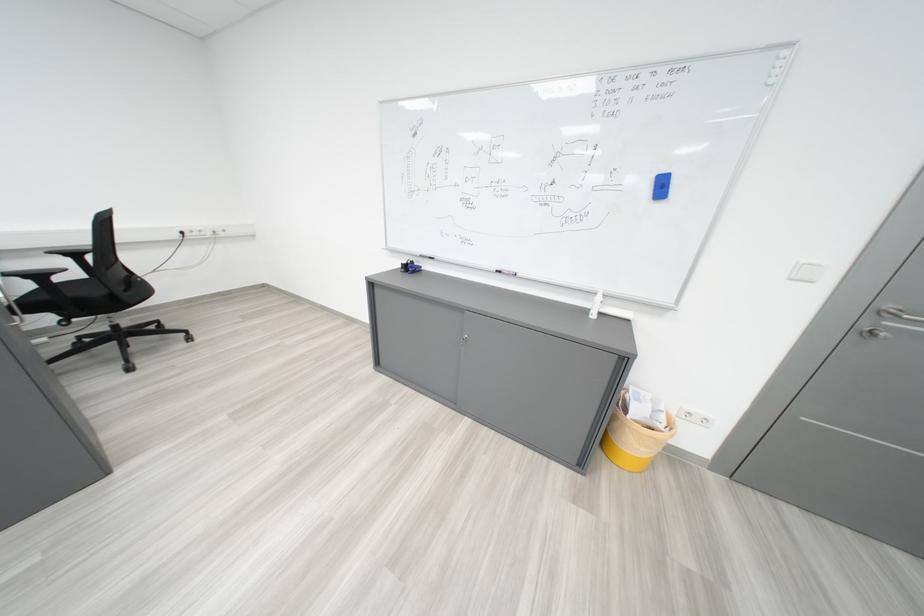
This screenshot has height=616, width=924. What do you see at coordinates (464, 338) in the screenshot? I see `the cabinet lock` at bounding box center [464, 338].